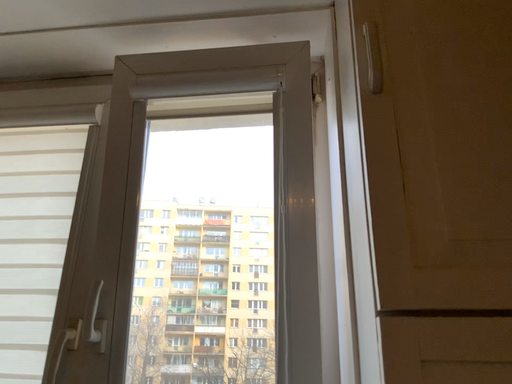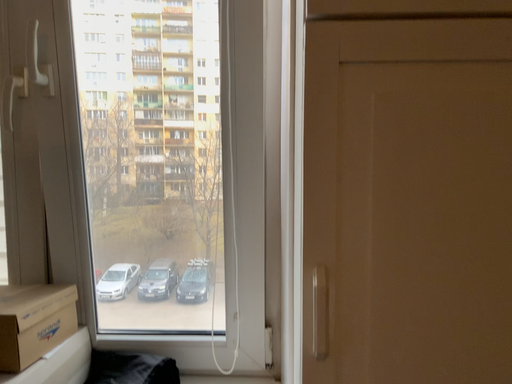
Question: How did the camera likely rotate when shooting the video?

Choices:
 (A) rotated downward
 (B) rotated upward

Answer: (A)